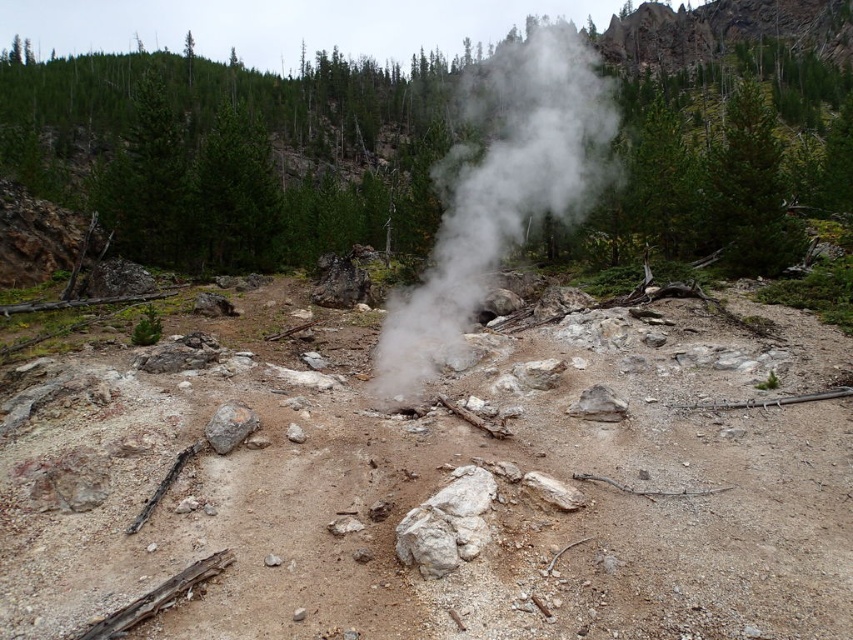
You are a geologist examining the geothermal area. You notice the white vapor at center and the rusty metallic rock at center. Which object occupies a greater area in the image?

The white vapor at center has a larger size compared to the rusty metallic rock at center, so it occupies a greater area in the image.

You are a hiker with a backpack weighing 20 kilograms. You need to walk from the brown sandy dirt track at center to the gray rough rock at center. Considering the distance between them, will you be able to walk directly between them without needing to detour around any obstacles?

The brown sandy dirt track at center and gray rough rock at center are 2.38 meters apart from each other. Since there are no obstacles mentioned between them in the scene description, you can walk directly between them without needing to detour.